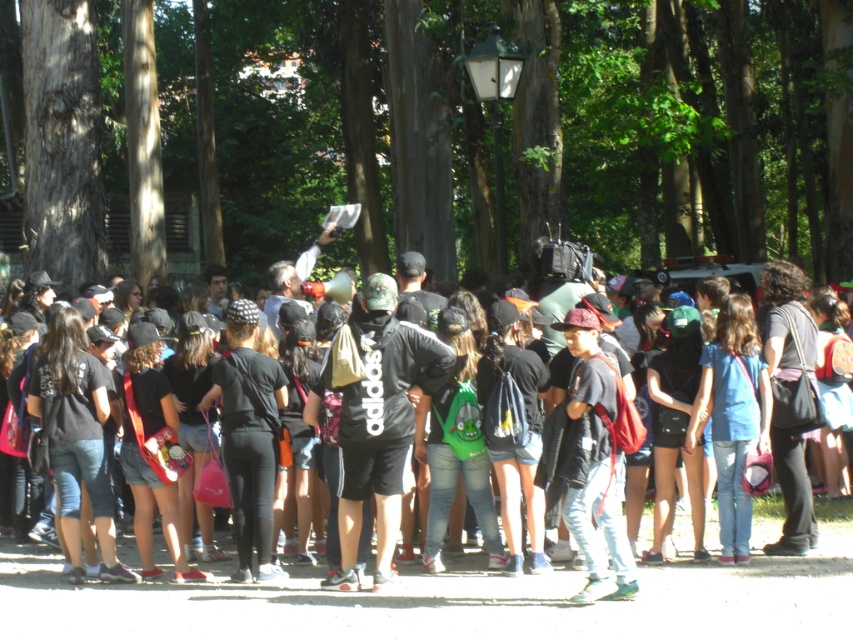
Question: Is brown textured tree at upper center wider than black matte shirt at center?

Choices:
 (A) yes
 (B) no

Answer: (A)

Question: Is brown textured tree at upper center positioned at the back of smooth brown tree trunk at left?

Choices:
 (A) yes
 (B) no

Answer: (B)

Question: Which of these objects is positioned closest to the smooth brown tree trunk at left?

Choices:
 (A) brown textured tree at upper center
 (B) black matte shirt at center

Answer: (B)

Question: Which of the following is the closest to the observer?

Choices:
 (A) (260, 230)
 (B) (82, 234)

Answer: (B)

Question: Observing the image, what is the correct spatial positioning of brown textured tree at upper center in reference to black matte shirt at center?

Choices:
 (A) left
 (B) right

Answer: (A)

Question: Which of the following is the farthest from the observer?

Choices:
 (A) (683, 150)
 (B) (79, 275)
 (C) (30, 556)

Answer: (A)